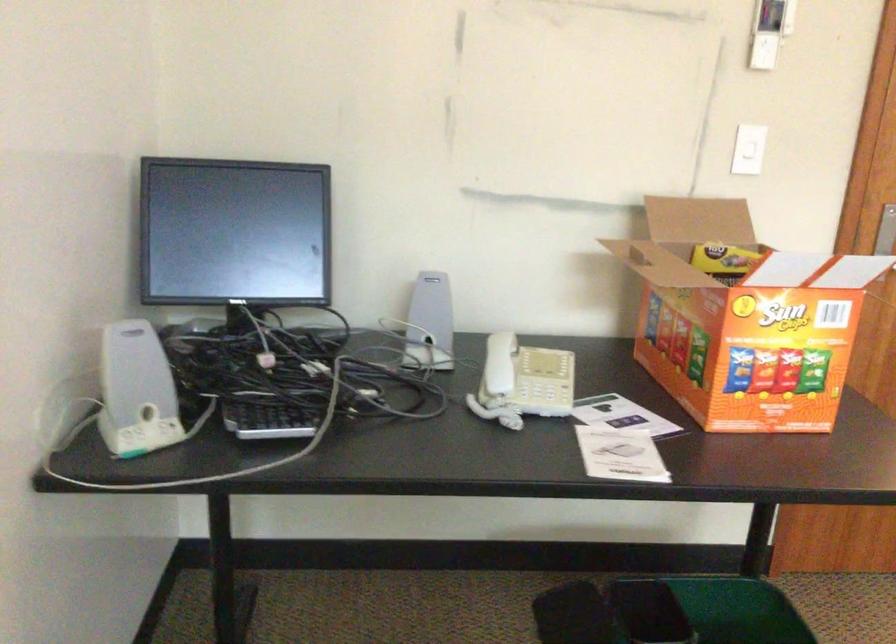
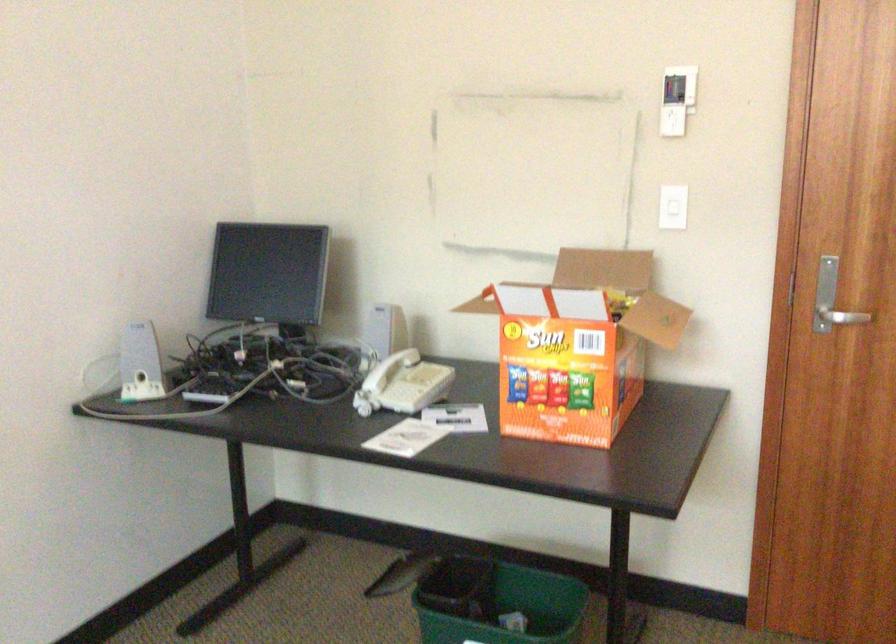
The point at [143,400] is marked in the first image. Where is the corresponding point in the second image?

(140, 363)